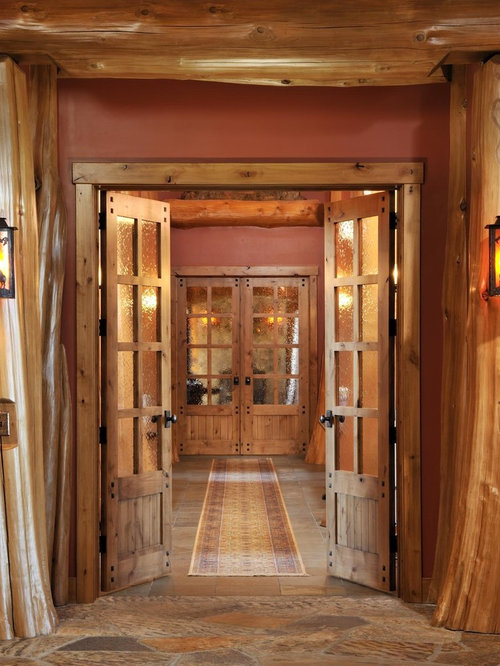
Find the location of a particular element. This screenshot has width=500, height=666. carpeted floor is located at coordinates (262, 639).